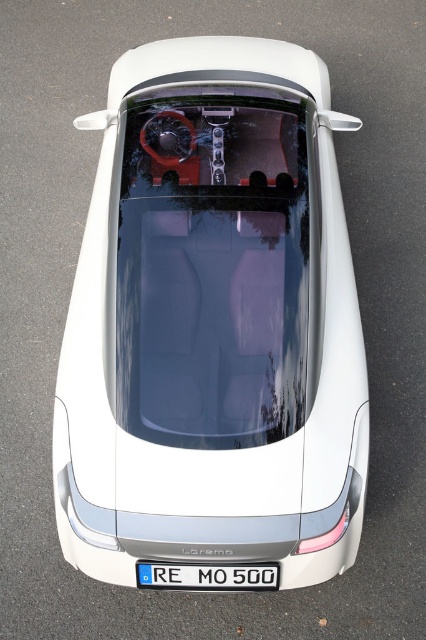
Which is more to the right, white matte car at center or transparent glass windshield at center?

transparent glass windshield at center is more to the right.

Based on the photo, can you confirm if white matte car at center is thinner than transparent glass windshield at center?

Incorrect, white matte car at center's width is not less than transparent glass windshield at center's.

Between point (229, 557) and point (172, 387), which one is positioned in front?

Point (229, 557)

This screenshot has height=640, width=426. Identify the location of white matte car at center. (213, 323).

Can you confirm if transparent glass windshield at center is bigger than white plastic license plate at center?

Yes, transparent glass windshield at center is bigger than white plastic license plate at center.

Does transparent glass windshield at center appear on the left side of white plastic license plate at center?

Incorrect, transparent glass windshield at center is not on the left side of white plastic license plate at center.

What do you see at coordinates (215, 268) in the screenshot?
I see `transparent glass windshield at center` at bounding box center [215, 268].

Find the location of a particular element. transparent glass windshield at center is located at coordinates (215, 268).

Is white matte car at center shorter than white plastic license plate at center?

No.

Does white matte car at center have a greater height compared to white plastic license plate at center?

Yes.

You are a GUI agent. You are given a task and a screenshot of the screen. Output one action in this format:
    pyautogui.click(x=<x>, y=<y>)
    Task: Click on the white matte car at center
    The width and height of the screenshot is (426, 640).
    Given the screenshot: What is the action you would take?
    pyautogui.click(x=213, y=323)